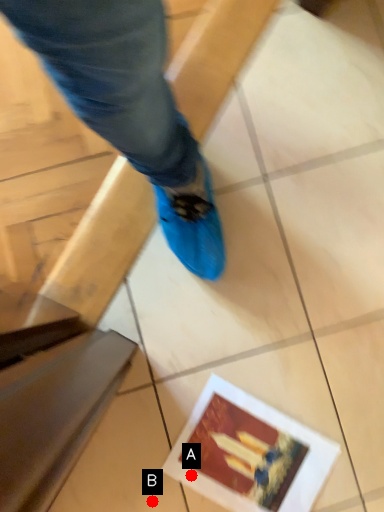
Question: Two points are circled on the image, labeled by A and B beside each circle. Which point is farther from the camera taking this photo?

Choices:
 (A) A is further
 (B) B is further

Answer: (A)